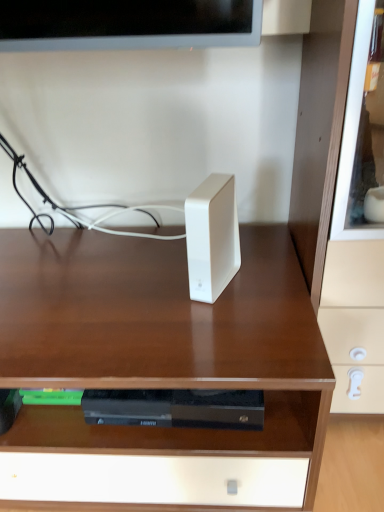
Question: From the image's perspective, is white glossy speaker at center above matte white drawer at right?

Choices:
 (A) yes
 (B) no

Answer: (B)

Question: From the image's perspective, is white glossy speaker at center under matte white drawer at right?

Choices:
 (A) no
 (B) yes

Answer: (B)

Question: Is white glossy speaker at center looking in the opposite direction of matte white drawer at right?

Choices:
 (A) yes
 (B) no

Answer: (B)

Question: Considering the relative sizes of white glossy speaker at center and matte white drawer at right in the image provided, is white glossy speaker at center thinner than matte white drawer at right?

Choices:
 (A) yes
 (B) no

Answer: (B)

Question: Considering the relative sizes of white glossy speaker at center and matte white drawer at right in the image provided, is white glossy speaker at center bigger than matte white drawer at right?

Choices:
 (A) yes
 (B) no

Answer: (A)

Question: Considering their positions, is matte white drawer at right located in front of or behind white glossy speaker at center?

Choices:
 (A) behind
 (B) front

Answer: (B)

Question: From a real-world perspective, is matte white drawer at right physically located above or below white glossy speaker at center?

Choices:
 (A) above
 (B) below

Answer: (A)

Question: Is point (302, 113) closer or farther from the camera than point (253, 506)?

Choices:
 (A) farther
 (B) closer

Answer: (A)

Question: Looking at their shapes, would you say matte white drawer at right is wider or thinner than white glossy speaker at center?

Choices:
 (A) thin
 (B) wide

Answer: (A)

Question: Is matte white drawer at right inside the boundaries of white matte ipod at center, or outside?

Choices:
 (A) outside
 (B) inside

Answer: (A)

Question: From the image's perspective, is matte white drawer at right positioned above or below white matte ipod at center?

Choices:
 (A) above
 (B) below

Answer: (A)

Question: Would you say matte white drawer at right is to the left or to the right of white matte ipod at center in the picture?

Choices:
 (A) right
 (B) left

Answer: (A)

Question: Is matte white drawer at right in front of or behind white matte ipod at center in the image?

Choices:
 (A) front
 (B) behind

Answer: (A)

Question: From the image's perspective, is white matte ipod at center located above or below matte white drawer at right?

Choices:
 (A) above
 (B) below

Answer: (B)

Question: Considering their positions, is white matte ipod at center located in front of or behind matte white drawer at right?

Choices:
 (A) behind
 (B) front

Answer: (A)